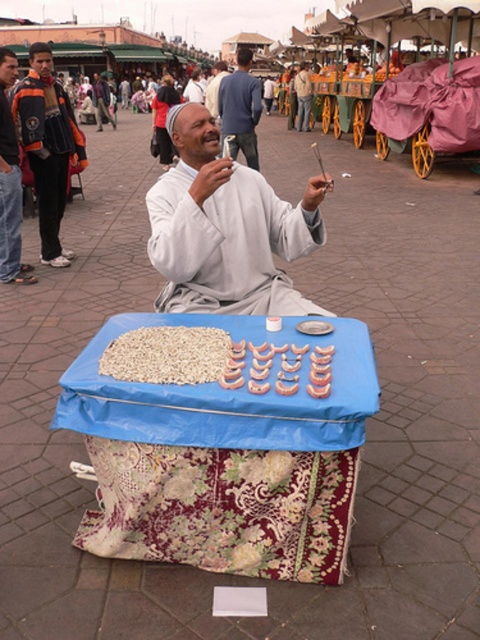
Question: Can you confirm if gray cotton man at center is positioned to the left of light brown grain at center?

Choices:
 (A) yes
 (B) no

Answer: (B)

Question: Which object is the closest to the matte gray shirt at center?

Choices:
 (A) dark blue jeans at left
 (B) light blue fabric at center
 (C) light brown leather jacket at upper center

Answer: (B)

Question: Observing the image, what is the correct spatial positioning of light brown grain at center in reference to golden brown doughnuts at center?

Choices:
 (A) left
 (B) right

Answer: (A)

Question: Considering the real-world distances, which object is closest to the light brown leather jacket at upper center?

Choices:
 (A) golden brown doughnuts at center
 (B) matte gray shirt at center
 (C) orange and black jacket at left
 (D) dark blue jeans at left

Answer: (B)

Question: Is gray cotton man at center thinner than dark blue jeans at left?

Choices:
 (A) no
 (B) yes

Answer: (A)

Question: Which point appears farthest from the camera in this image?

Choices:
 (A) (222, 234)
 (B) (48, 202)

Answer: (B)